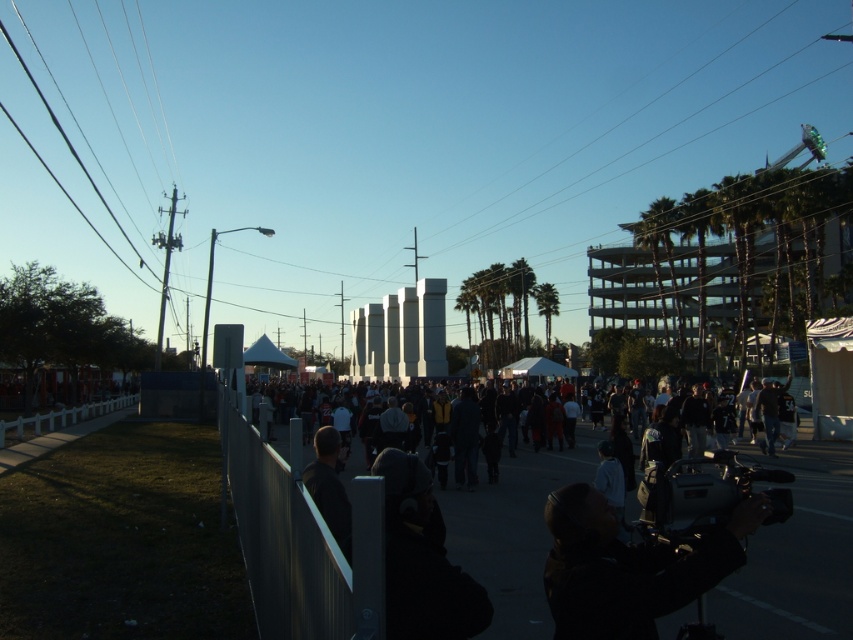
Who is positioned more to the right, black matte camera at lower right or white plastic fence at lower left?

From the viewer's perspective, black matte camera at lower right appears more on the right side.

Between black matte camera at lower right and white plastic fence at lower left, which one is positioned lower?

Positioned lower is white plastic fence at lower left.

Does point (584, 630) lie behind point (136, 397)?

No, (584, 630) is in front of (136, 397).

Where is `black matte camera at lower right`? The width and height of the screenshot is (853, 640). black matte camera at lower right is located at coordinates (628, 566).

Is green leafy palm tree at upper right thinner than green leafy palm tree at right?

Yes, green leafy palm tree at upper right is thinner than green leafy palm tree at right.

Between green leafy palm tree at upper right and green leafy palm tree at right, which one has more height?

Answer: green leafy palm tree at right is taller.

Who is more forward, [654,204] or [705,337]?

Positioned in front is point [654,204].

You are a GUI agent. You are given a task and a screenshot of the screen. Output one action in this format:
    pyautogui.click(x=<x>, y=<y>)
    Task: Click on the green leafy palm tree at upper right
    The image size is (853, 640).
    Given the screenshot: What is the action you would take?
    pyautogui.click(x=659, y=257)

Who is higher up, dark clothing at center or green leafy palm tree at right?

Positioned higher is green leafy palm tree at right.

Locate an element on the screen. This screenshot has width=853, height=640. dark clothing at center is located at coordinates (512, 531).